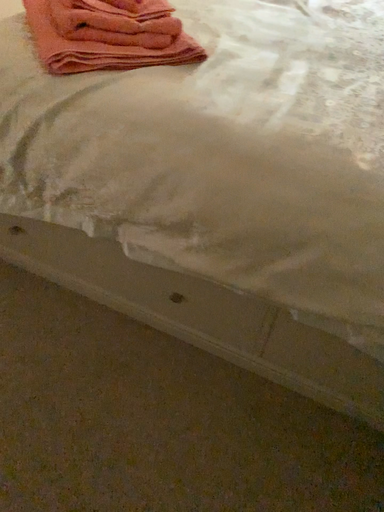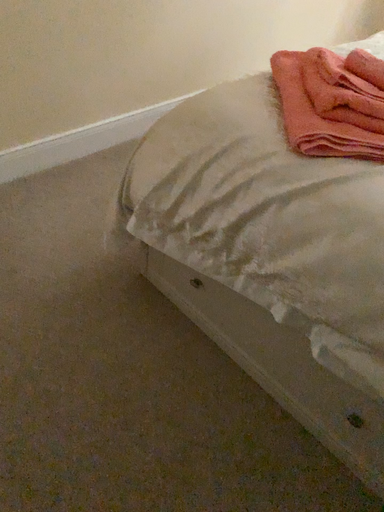
Question: How did the camera likely rotate when shooting the video?

Choices:
 (A) rotated right
 (B) rotated left

Answer: (B)